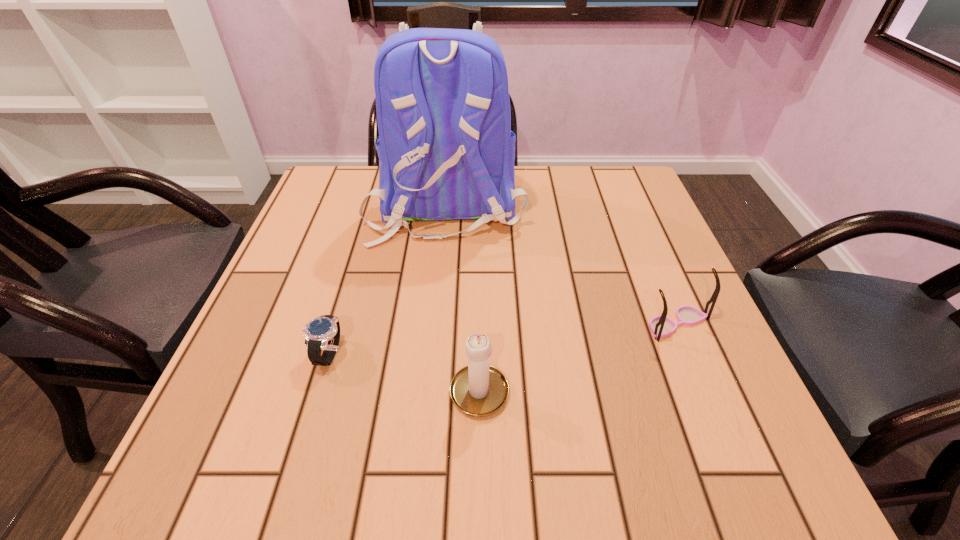
This screenshot has width=960, height=540. In order to click on vacant space located 0.320m on the back of the spectacles in this screenshot , I will do `click(630, 210)`.

Find the location of `free location located on the right of the watch`. free location located on the right of the watch is located at coordinates pyautogui.click(x=440, y=354).

At what (x,y) coordinates should I click in order to perform the action: click on object at the far edge. Please return your answer as a coordinate pair (x, y). Looking at the image, I should click on (446, 151).

Locate an element on the screen. The width and height of the screenshot is (960, 540). backpack that is positioned at the left edge is located at coordinates (446, 151).

Locate an element on the screen. watch positioned at the left edge is located at coordinates (322, 333).

You are a GUI agent. You are given a task and a screenshot of the screen. Output one action in this format:
    pyautogui.click(x=<x>, y=<y>)
    Task: Click on the object that is at the right edge
    This screenshot has width=960, height=540.
    Given the screenshot: What is the action you would take?
    pyautogui.click(x=661, y=326)

The image size is (960, 540). What are the coordinates of `object located in the far left corner section of the desktop` in the screenshot? It's located at (446, 151).

The image size is (960, 540). What are the coordinates of `vacant space at the near edge of the desktop` in the screenshot? It's located at (492, 471).

The height and width of the screenshot is (540, 960). In the image, there is a desktop. Identify the location of free space at the left edge. (300, 232).

The image size is (960, 540). What are the coordinates of `free space at the right edge` in the screenshot? It's located at (631, 253).